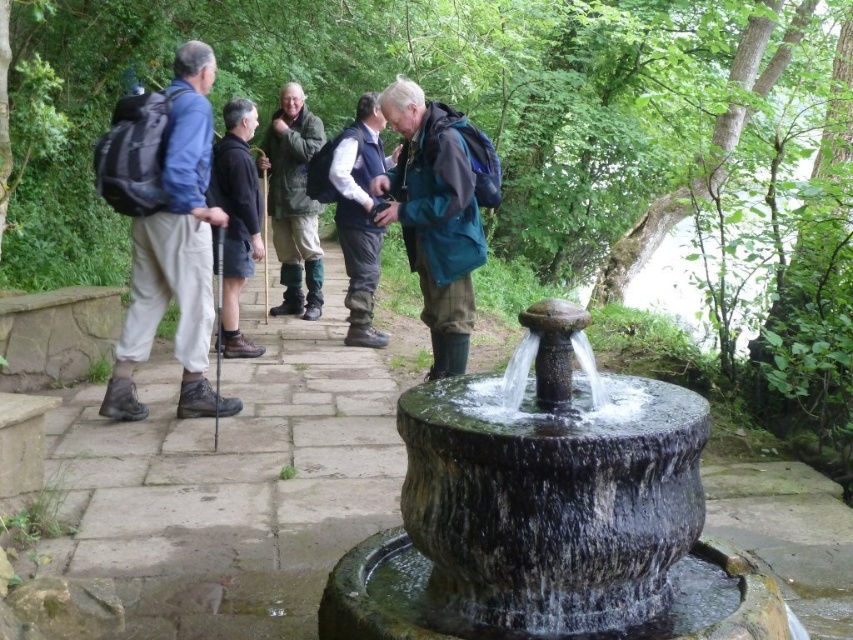
Is point (509, 481) less distant than point (448, 301)?

Yes, point (509, 481) is in front of point (448, 301).

Is point (428, 524) farther from viewer compared to point (390, 172)?

No, it is not.

Locate an element on the screen. Image resolution: width=853 pixels, height=640 pixels. dark gray stone fountain at center is located at coordinates (550, 513).

Is green matte jacket at center closer to camera compared to blue-green fabric vest at center?

Yes, green matte jacket at center is in front of blue-green fabric vest at center.

At what (x,y) coordinates should I click in order to perform the action: click on green matte jacket at center. Please return your answer as a coordinate pair (x, y). Looking at the image, I should click on (434, 218).

In order to click on green matte jacket at center in this screenshot , I will do `click(434, 218)`.

Which is below, dark gray stone fountain at center or green rubber boots at center?

dark gray stone fountain at center

Who is taller, dark gray stone fountain at center or green rubber boots at center?

green rubber boots at center

Where is `dark gray stone fountain at center`? The image size is (853, 640). dark gray stone fountain at center is located at coordinates (550, 513).